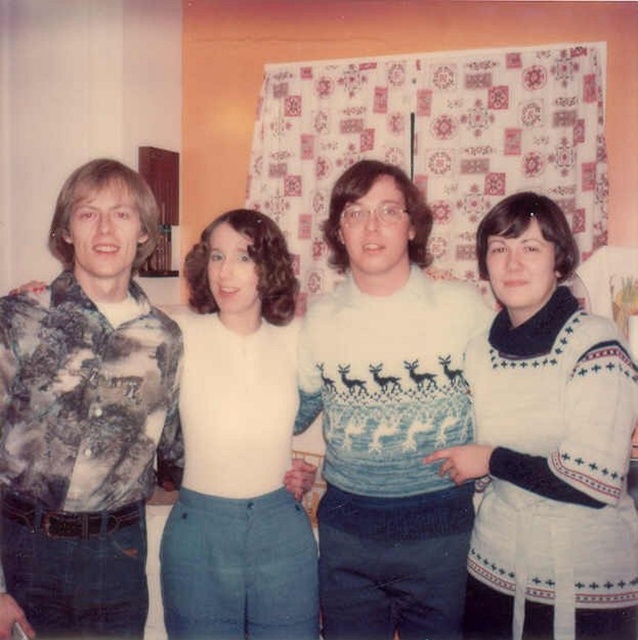
You are organizing a clothing donation drive and need to categorize items by size. You have two items to assess from the image description provided. The first is the printed fabric shirt at left, and the second is the white matte sweater at center. Based on the visual information given, which clothing item is larger in height?

The printed fabric shirt at left has a greater height compared to the white matte sweater at center, so the printed fabric shirt at left is larger in height.

You are trying to decide which clothing item to choose for an event. You see the printed fabric shirt at left and the white knitted sweater at center. Which one is taller?

The printed fabric shirt at left is taller than the white knitted sweater at center.